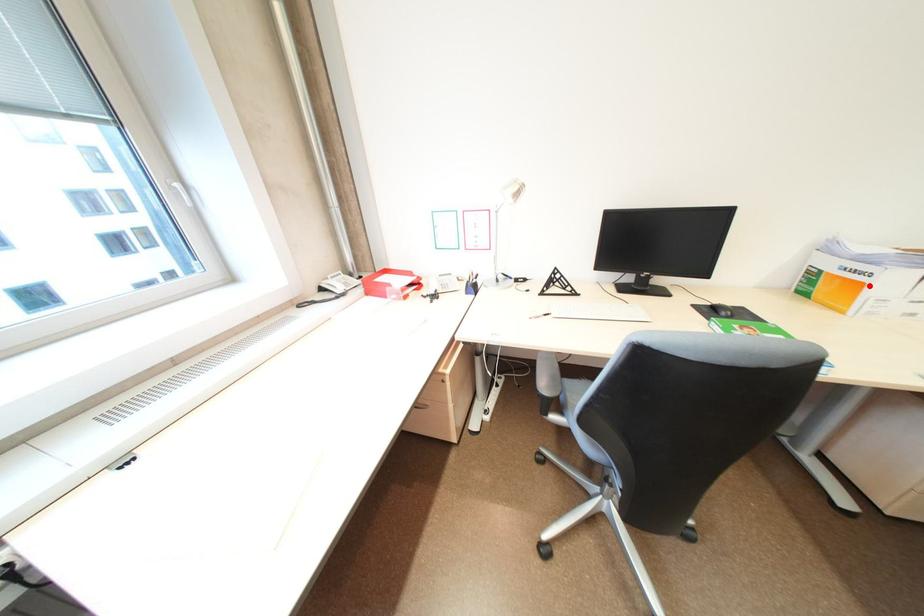
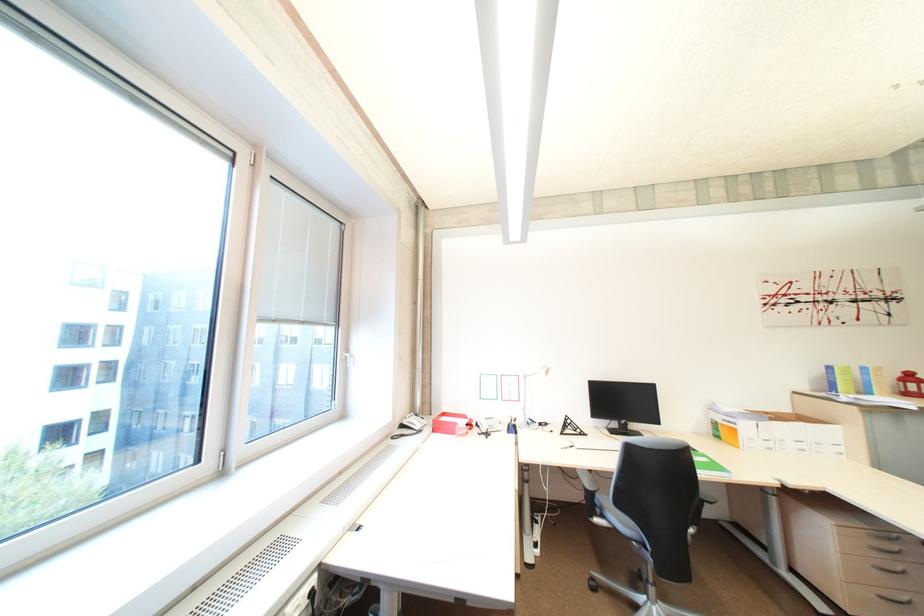
Question: A red point is marked in image1. In image2, is the corresponding 3D point closer to the camera or farther? Reply with the corresponding letter.

Choices:
 (A) The corresponding 3D point is closer.
 (B) The corresponding 3D point is farther.

Answer: (A)